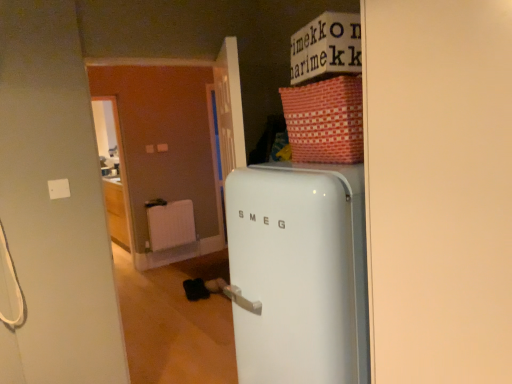
Question: From a real-world perspective, relative to white matte radiator at center, is white glossy refrigerator at center vertically above or below?

Choices:
 (A) above
 (B) below

Answer: (A)

Question: Considering the positions of white glossy refrigerator at center and white matte radiator at center in the image, is white glossy refrigerator at center wider or thinner than white matte radiator at center?

Choices:
 (A) wide
 (B) thin

Answer: (A)

Question: Which is nearer to the white matte radiator at center?

Choices:
 (A) white glossy refrigerator at center
 (B) red woven basket at upper right

Answer: (A)

Question: Based on their relative distances, which object is nearer to the white matte radiator at center?

Choices:
 (A) red woven basket at upper right
 (B) white glossy refrigerator at center

Answer: (B)